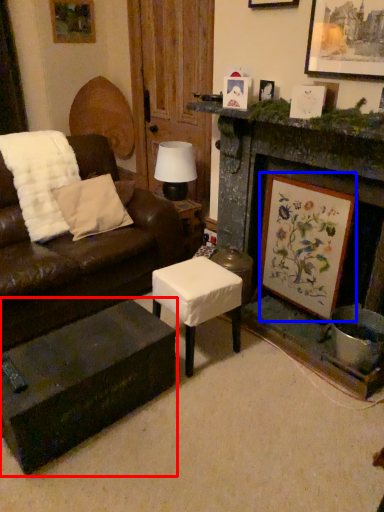
Question: Which of the following is the closest to the observer, coffee table (highlighted by a red box) or picture frame (highlighted by a blue box)?

Choices:
 (A) coffee table
 (B) picture frame

Answer: (A)